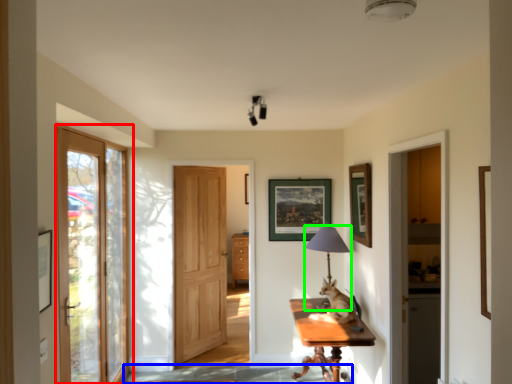
Question: Which object is the farthest from door (highlighted by a red box)? Choose among these: path (highlighted by a blue box) or table lamp (highlighted by a green box).

Choices:
 (A) path
 (B) table lamp

Answer: (B)